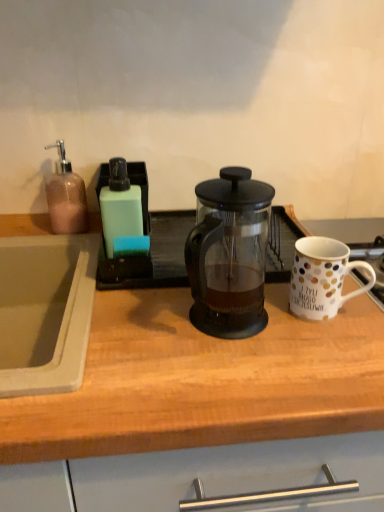
You are a GUI agent. You are given a task and a screenshot of the screen. Output one action in this format:
    pyautogui.click(x=<x>, y=<y>)
    Task: Click on the transparent glass french press at center
    
    Given the screenshot: What is the action you would take?
    pyautogui.click(x=230, y=254)

What is the approximate width of transparent glass french press at center?

The width of transparent glass french press at center is 64.06 centimeters.

Where is `transparent glass french press at center`? transparent glass french press at center is located at coordinates (230, 254).

Which object is thinner, transparent glass french press at center or transparent glass french press at center?

Thinner between the two is transparent glass french press at center.

Find the location of a particular element. countertop below the transparent glass french press at center (from a real-world perspective) is located at coordinates point(203,381).

Is transparent glass french press at center positioned with its back to transparent glass french press at center?

transparent glass french press at center is not turned away from transparent glass french press at center.

From the picture: Can you confirm if transparent glass french press at center is bigger than white polka dot ceramic mug at right?

Correct, transparent glass french press at center is larger in size than white polka dot ceramic mug at right.

Looking at this image, considering the relative sizes of transparent glass french press at center and white polka dot ceramic mug at right in the image provided, is transparent glass french press at center wider than white polka dot ceramic mug at right?

Correct, the width of transparent glass french press at center exceeds that of white polka dot ceramic mug at right.

Can you tell me how much transparent glass french press at center and white polka dot ceramic mug at right differ in facing direction?

They differ by 14.8 degrees in their facing directions.

Is white polka dot ceramic mug at right a part of transparent glass french press at center?

No, white polka dot ceramic mug at right is not surrounded by transparent glass french press at center.

Choose the correct answer: Is white polka dot ceramic mug at right inside transparent glass french press at center or outside it?

white polka dot ceramic mug at right is spatially situated outside transparent glass french press at center.

Can you see white polka dot ceramic mug at right touching transparent glass french press at center?

No, white polka dot ceramic mug at right is not in contact with transparent glass french press at center.

Image resolution: width=384 pixels, height=512 pixels. Identify the location of coffee cup that appears behind the transparent glass french press at center. (322, 277).

Which is closer to the camera, [300,293] or [260,265]?

Point [300,293] is closer to the camera than point [260,265].

From the image's perspective, is transparent glass french press at center located above white polka dot ceramic mug at right?

Yes, from the image's perspective, transparent glass french press at center is on top of white polka dot ceramic mug at right.

In the scene shown: From a real-world perspective, is transparent glass french press at center physically below white polka dot ceramic mug at right?

Incorrect, from a real-world perspective, transparent glass french press at center is higher than white polka dot ceramic mug at right.

Which is behind, transparent glass french press at center or transparent glass french press at center?

transparent glass french press at center is behind.

This screenshot has height=512, width=384. What are the coordinates of `countertop below the transparent glass french press at center (from a real-world perspective)` in the screenshot? It's located at (203, 381).

Is transparent glass french press at center oriented away from transparent glass french press at center?

No, transparent glass french press at center is not facing the opposite direction of transparent glass french press at center.

Considering the points (299, 295) and (203, 353), which point is in front, point (299, 295) or point (203, 353)?

Positioned in front is point (203, 353).

Can you confirm if white polka dot ceramic mug at right is shorter than transparent glass french press at center?

Indeed, white polka dot ceramic mug at right has a lesser height compared to transparent glass french press at center.

Locate an element on the screen. The height and width of the screenshot is (512, 384). countertop lying below the white polka dot ceramic mug at right (from the image's perspective) is located at coordinates coord(203,381).

From a real-world perspective, is white polka dot ceramic mug at right physically below transparent glass french press at center?

No, from a real-world perspective, white polka dot ceramic mug at right is not beneath transparent glass french press at center.

The height and width of the screenshot is (512, 384). Find the location of `kettle located behind the transparent glass french press at center`. kettle located behind the transparent glass french press at center is located at coordinates (230, 254).

I want to click on countertop directly beneath the white polka dot ceramic mug at right (from a real-world perspective), so click(x=203, y=381).

When comparing their distances from white polka dot ceramic mug at right, does transparent glass french press at center or transparent glass french press at center seem further?

Among the two, transparent glass french press at center is located further to white polka dot ceramic mug at right.

From the image, which object appears to be nearer to transparent glass french press at center, transparent glass french press at center or white polka dot ceramic mug at right?

Result: Based on the image, transparent glass french press at center appears to be nearer to transparent glass french press at center.

Based on their spatial positions, is white polka dot ceramic mug at right or transparent glass french press at center further from transparent glass french press at center?

white polka dot ceramic mug at right lies further to transparent glass french press at center than the other object.

Based on their spatial positions, is transparent glass french press at center or transparent glass french press at center closer to white polka dot ceramic mug at right?

Among the two, transparent glass french press at center is located nearer to white polka dot ceramic mug at right.

From the image, which object appears to be nearer to transparent glass french press at center, white polka dot ceramic mug at right or transparent glass french press at center?

white polka dot ceramic mug at right lies closer to transparent glass french press at center than the other object.

Looking at this image, from the image, which object appears to be farther from transparent glass french press at center, transparent glass french press at center or white polka dot ceramic mug at right?

transparent glass french press at center is further to transparent glass french press at center.

Identify the location of coffee cup between transparent glass french press at center and transparent glass french press at center in the up-down direction. (322, 277).